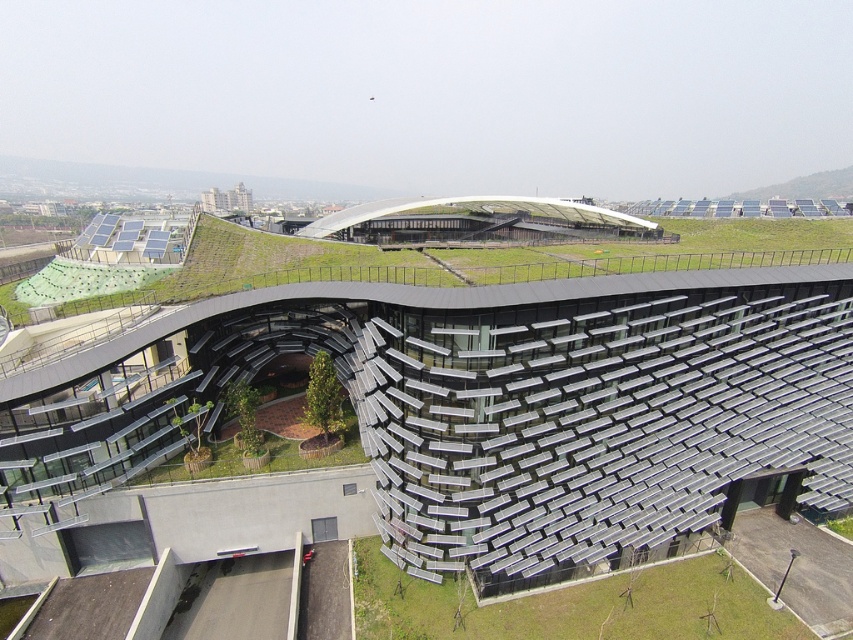
You are standing in front of the modern architectural structure and want to take a photo of both the metallic solar panels at center and the green grass at upper center. Which object should you focus on first to ensure both are in clear view?

You should focus on the metallic solar panels at center first because they are closer to you than the green grass at upper center, so adjusting focus from near to far will help both be in clear view.

In the scene shown: You are an architect designing a new eco park and need to decide where to place a 3m wide water fountain. The scene shows two areas of green grass at upper center and green grass at lower right. Which area can accommodate the fountain without reducing its width?

The green grass at upper center has a larger width than the green grass at lower right, so the 3m wide water fountain can be placed there without reducing its width.